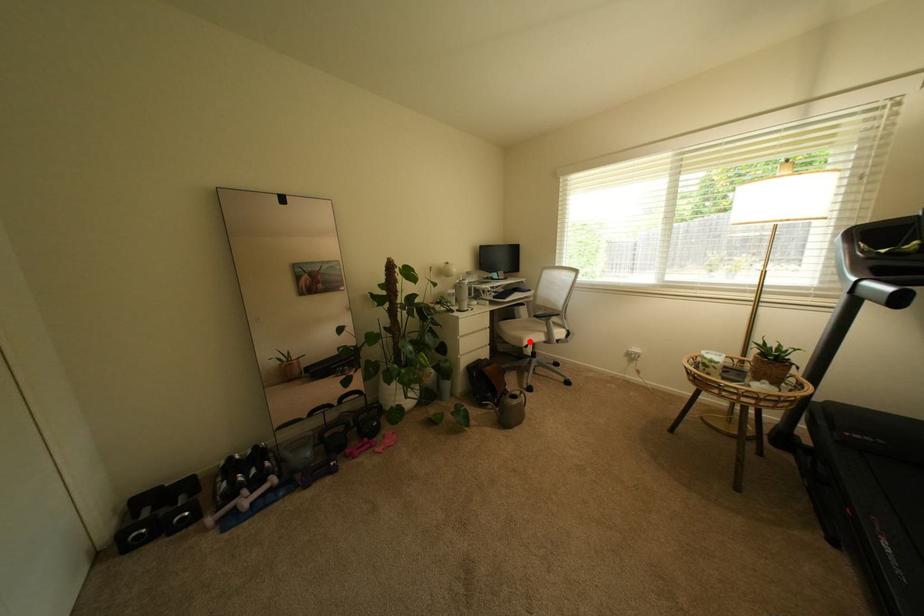
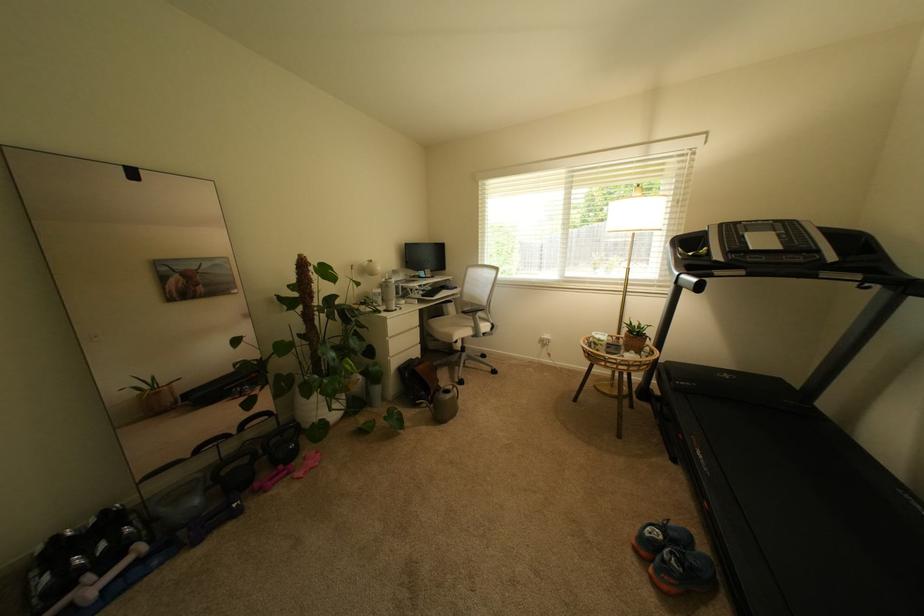
Find the pixel in the second image that matches the highlighted location in the first image.

(459, 338)